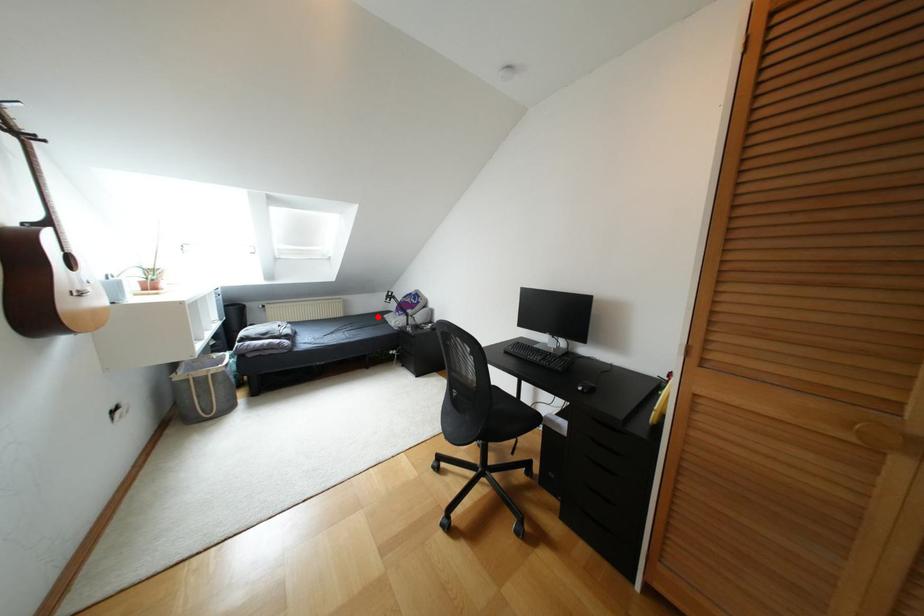
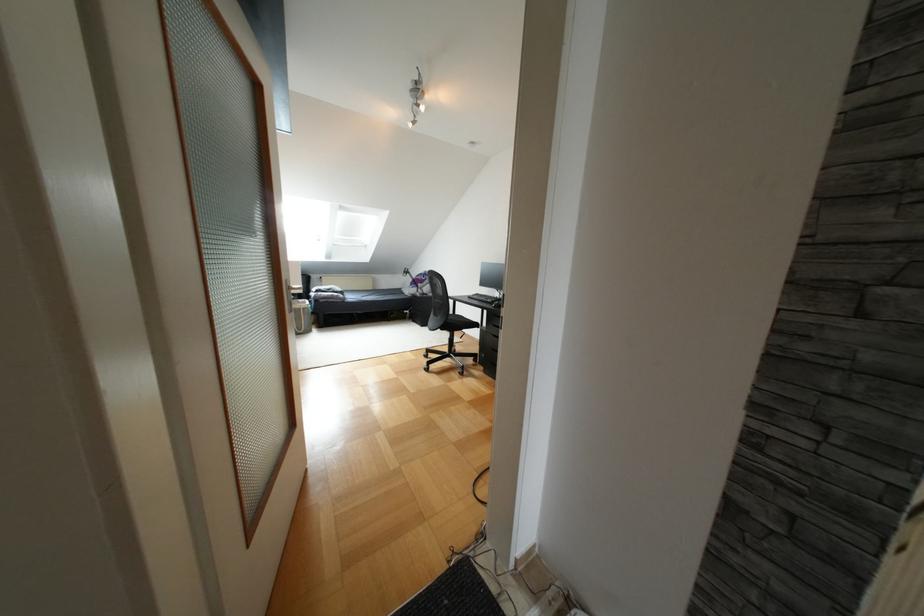
Question: I am providing you with two images of the same scene from different viewpoints. A red point is shown in image1. For the corresponding object point in image2, is it positioned nearer or farther from the camera?

Choices:
 (A) Nearer
 (B) Farther

Answer: (A)